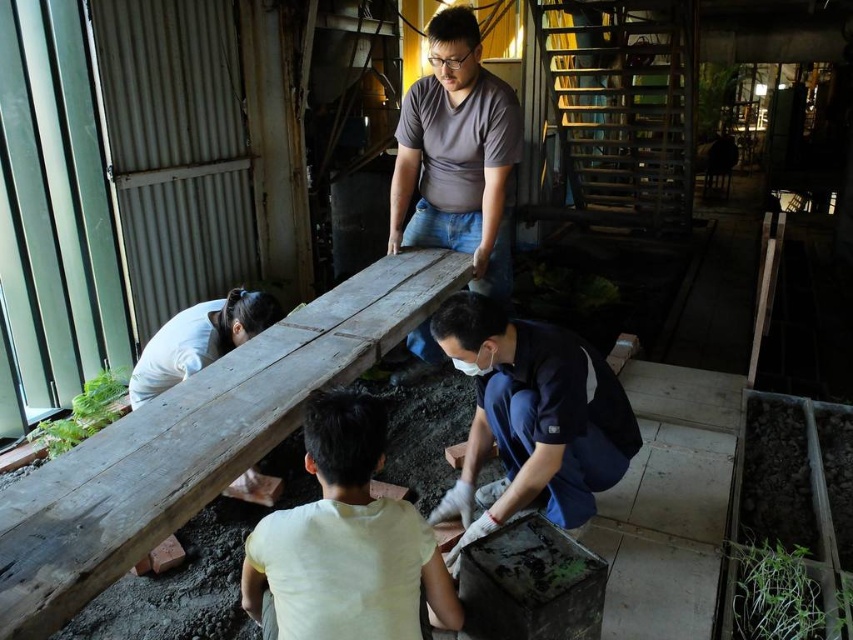
Question: Can you confirm if dark blue uniform at lower center is bigger than green leafy plant at lower center?

Choices:
 (A) no
 (B) yes

Answer: (B)

Question: Is matte brown wood plank at center to the left of green leafy plant at lower right from the viewer's perspective?

Choices:
 (A) no
 (B) yes

Answer: (B)

Question: Among these points, which one is farthest from the camera?

Choices:
 (A) 466,168
 (B) 523,497
 (C) 560,576
 (D) 799,582

Answer: (A)

Question: Which is nearer to the green leafy plant at lower right?

Choices:
 (A) green leafy plant at left
 (B) weathered wood beam at center

Answer: (B)

Question: Which is farther from the green leafy plant at lower right?

Choices:
 (A) green leafy plant at left
 (B) matte brown wood plank at center

Answer: (A)

Question: Does dark blue uniform at lower center have a lesser width compared to green leafy plant at lower center?

Choices:
 (A) yes
 (B) no

Answer: (B)